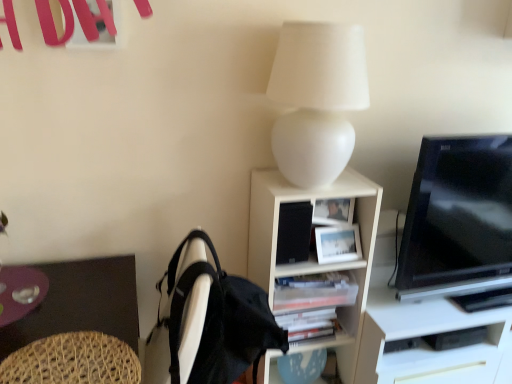
Question: In terms of width, does woven wood swivel chair at lower left look wider or thinner when compared to transparent glass plate at lower left?

Choices:
 (A) thin
 (B) wide

Answer: (B)

Question: From a real-world perspective, relative to transparent glass plate at lower left, is woven wood swivel chair at lower left vertically above or below?

Choices:
 (A) below
 (B) above

Answer: (B)

Question: Which of these objects is positioned closest to the white matte shelf at center?

Choices:
 (A) woven wood swivel chair at lower left
 (B) black glossy tv at right
 (C) white matte lamp at upper center
 (D) brown woven desk at lower left
 (E) black matte speaker at center

Answer: (E)

Question: Which is nearer to the white matte lamp at upper center?

Choices:
 (A) black fabric backpack at lower left
 (B) white matte shelf at center
 (C) black matte speaker at center
 (D) transparent glass plate at lower left
 (E) brown woven desk at lower left

Answer: (B)